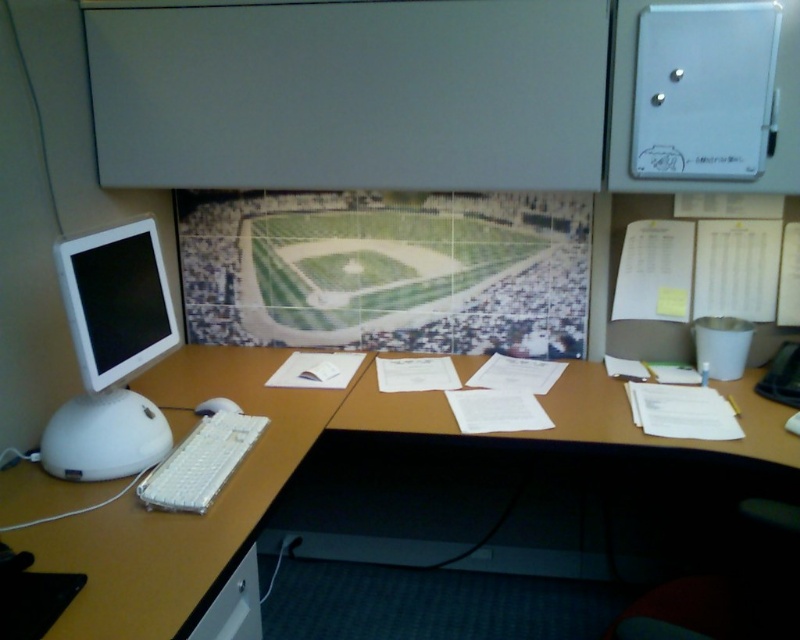
You are an office worker who needs to reach both the white plastic computer desk at center and the white glossy monitor at left. Which object will you need to walk further to reach?

The white glossy monitor at left is further away from the viewer than the white plastic computer desk at center, so you will need to walk further to reach the white glossy monitor at left.

You are organizing the desk and need to place a new document organizer. The organizer requires 10 inches of space between the white glossy monitor at left and the white plastic mouse at lower left. Is there enough space between them?

The white glossy monitor at left is to the left of the white plastic mouse at lower left, so there is sufficient space between them for the document organizer requiring 10 inches.

You are an office worker who needs to place a new monitor on the desk. The monitor requires 30 cm of space in front of it. Can you determine if there is enough space on the white plastic computer desk at center based on its position?

The white plastic computer desk at center is located at point (218, 496), but without knowing the desk dimensions or the available space in front, it is impossible to determine if there is enough space for the monitor. More information is needed.